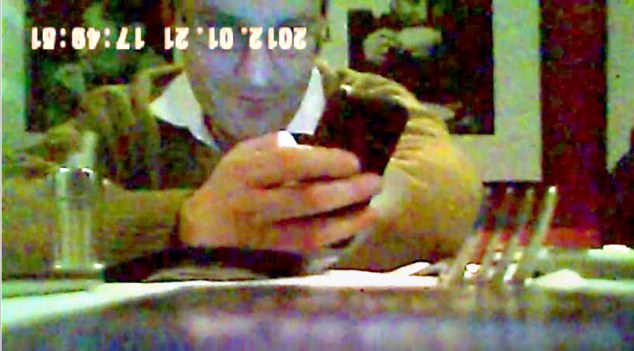
Where is `salt shaker`? salt shaker is located at coordinates (89, 221).